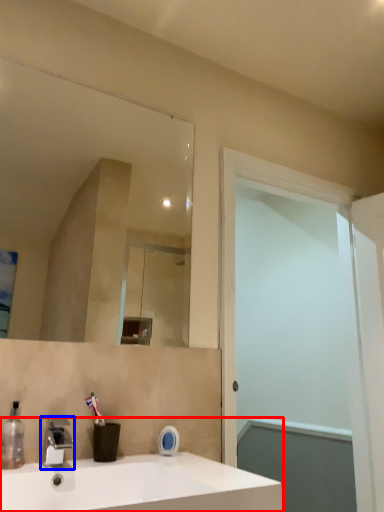
Question: Among these objects, which one is nearest to the camera, sink (highlighted by a red box) or tap (highlighted by a blue box)?

Choices:
 (A) sink
 (B) tap

Answer: (A)